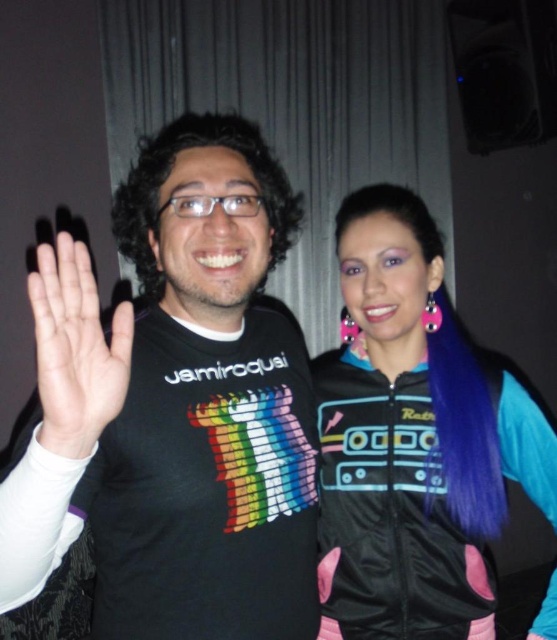
Question: Where is black matte t-shirt at center located in relation to white matte hand at center in the image?

Choices:
 (A) left
 (B) right

Answer: (B)

Question: Based on their relative distances, which object is nearer to the blue synthetic wig at upper right?

Choices:
 (A) black matte t-shirt at center
 (B) white matte hand at center
 (C) dark curly hair at center

Answer: (A)

Question: Does black matte t-shirt at center appear over blue synthetic wig at upper right?

Choices:
 (A) yes
 (B) no

Answer: (A)

Question: Among these objects, which one is nearest to the camera?

Choices:
 (A) dark curly hair at center
 (B) black matte t-shirt at center

Answer: (B)

Question: Among these objects, which one is nearest to the camera?

Choices:
 (A) black matte t-shirt at center
 (B) white matte hand at center
 (C) blue synthetic wig at upper right

Answer: (A)

Question: Does blue synthetic wig at upper right have a larger size compared to dark curly hair at center?

Choices:
 (A) no
 (B) yes

Answer: (B)